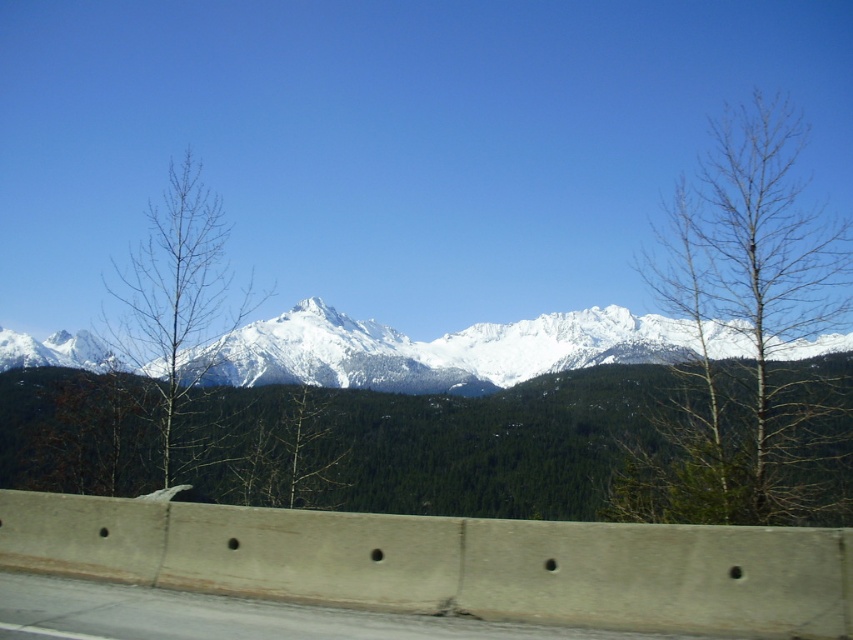
Question: Which point is closer to the camera?

Choices:
 (A) bare wood tree at left
 (B) bare wood tree at right
 (C) white snow-covered mountain range at center

Answer: (B)

Question: Can you confirm if bare wood tree at right is thinner than bare wood tree at left?

Choices:
 (A) no
 (B) yes

Answer: (A)

Question: Considering the real-world distances, which object is closest to the bare wood tree at right?

Choices:
 (A) white snow-covered mountain range at center
 (B) bare wood tree at left

Answer: (A)

Question: Does bare wood tree at right appear over bare wood tree at left?

Choices:
 (A) yes
 (B) no

Answer: (A)

Question: Does bare wood tree at right appear on the left side of white snow-covered mountain range at center?

Choices:
 (A) no
 (B) yes

Answer: (A)

Question: Which point is farther from the camera taking this photo?

Choices:
 (A) (821, 509)
 (B) (196, 330)
 (C) (636, 333)

Answer: (C)